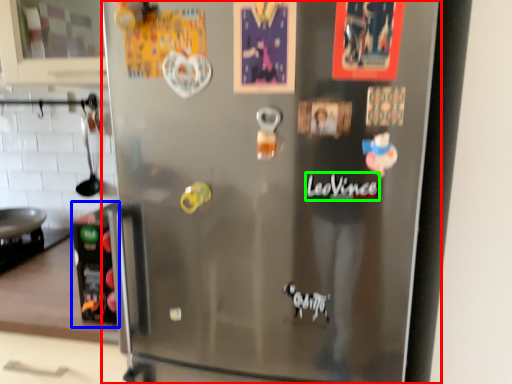
Question: Which object is positioned farthest from refrigerator (highlighted by a red box)? Select from appliance (highlighted by a blue box) and writing (highlighted by a green box).

Choices:
 (A) appliance
 (B) writing

Answer: (B)